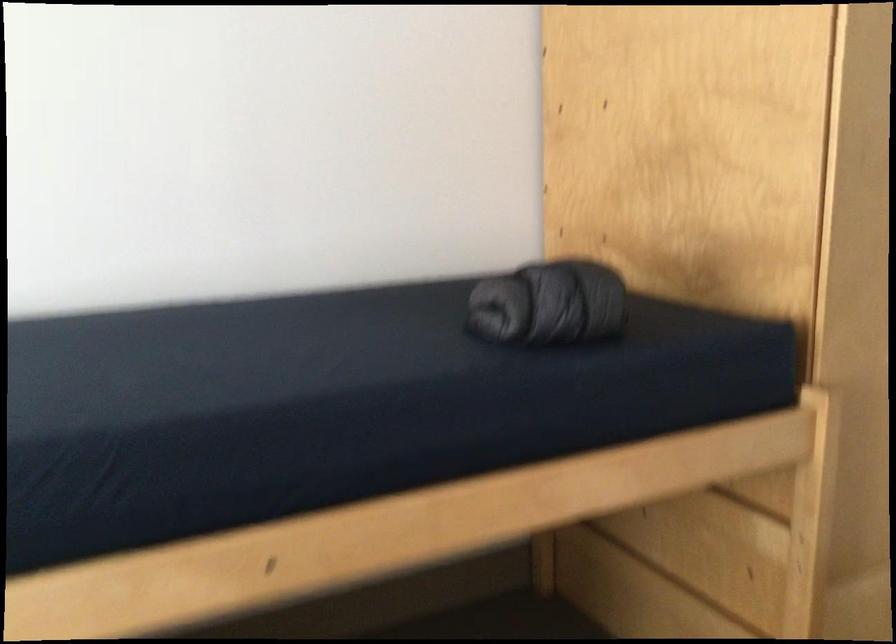
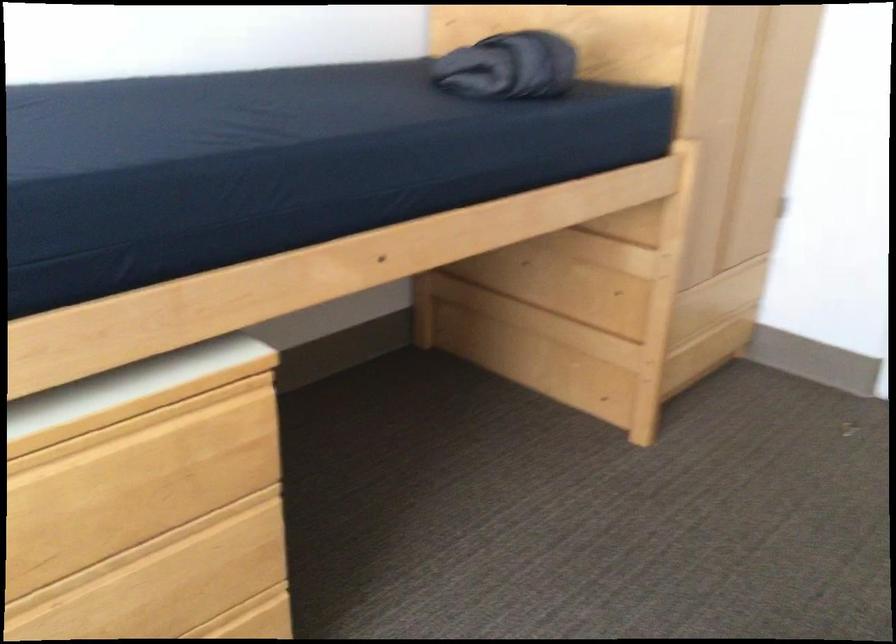
Question: The camera is either moving clockwise (left) or counter-clockwise (right) around the object. The first image is from the beginning of the video and the second image is from the end. Is the camera moving left or right when shooting the video?

Choices:
 (A) Left
 (B) Right

Answer: (A)